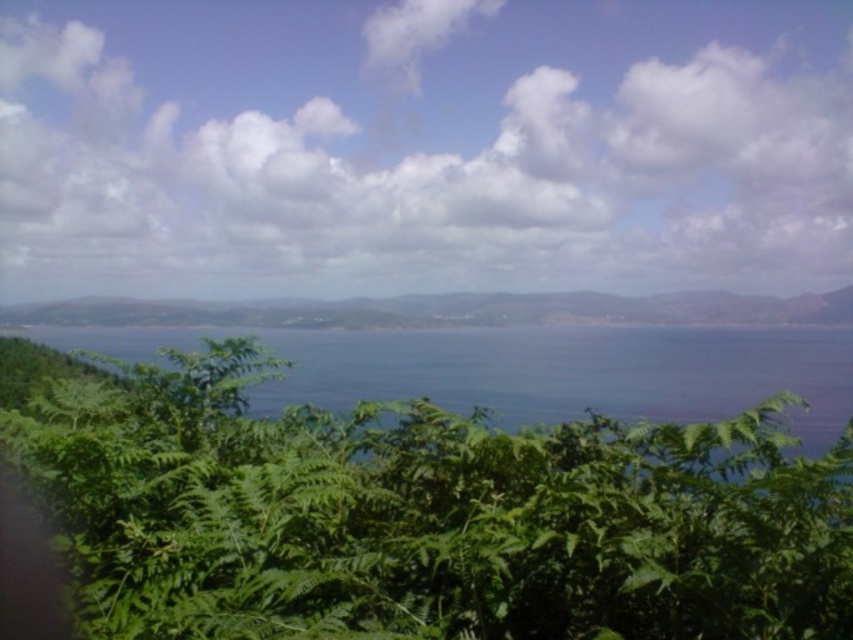
Consider the image. Is blue liquid water at center further to camera compared to green leafy vegetation at center?

No, it is in front of green leafy vegetation at center.

Who is positioned more to the right, blue liquid water at center or green leafy vegetation at center?

green leafy vegetation at center is more to the right.

Locate an element on the screen. Image resolution: width=853 pixels, height=640 pixels. blue liquid water at center is located at coordinates (532, 369).

Can you confirm if white fluffy cloud at upper center is positioned below blue liquid water at center?

Incorrect, white fluffy cloud at upper center is not positioned below blue liquid water at center.

Does white fluffy cloud at upper center have a greater width compared to blue liquid water at center?

Correct, the width of white fluffy cloud at upper center exceeds that of blue liquid water at center.

You are a GUI agent. You are given a task and a screenshot of the screen. Output one action in this format:
    pyautogui.click(x=<x>, y=<y>)
    Task: Click on the white fluffy cloud at upper center
    The width and height of the screenshot is (853, 640).
    Given the screenshot: What is the action you would take?
    pyautogui.click(x=422, y=147)

Based on the photo, does white fluffy cloud at upper center have a greater width compared to green leafy vegetation at center?

Indeed, white fluffy cloud at upper center has a greater width compared to green leafy vegetation at center.

Does white fluffy cloud at upper center have a lesser width compared to green leafy vegetation at center?

No.

This screenshot has height=640, width=853. I want to click on white fluffy cloud at upper center, so click(422, 147).

At what (x,y) coordinates should I click in order to perform the action: click on white fluffy cloud at upper center. Please return your answer as a coordinate pair (x, y). The height and width of the screenshot is (640, 853). Looking at the image, I should click on (422, 147).